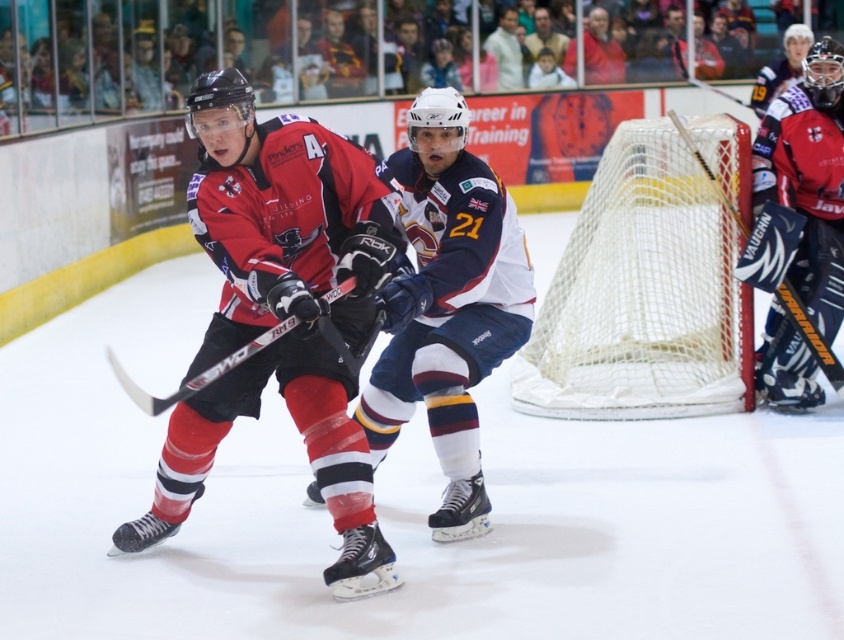
Find the location of a particular element. The height and width of the screenshot is (640, 844). matte black jersey at center is located at coordinates (280, 312).

Is point (301, 234) farther from viewer compared to point (837, 368)?

No, it is in front of (837, 368).

Where is `matte black jersey at center`? This screenshot has height=640, width=844. matte black jersey at center is located at coordinates pyautogui.click(x=280, y=312).

Identify the location of matte black jersey at center. (280, 312).

Looking at this image, is red matte goalie at right below black matte hockey stick at center?

No, red matte goalie at right is not below black matte hockey stick at center.

Is red matte goalie at right bigger than black matte hockey stick at center?

Yes.

The height and width of the screenshot is (640, 844). What are the coordinates of `red matte goalie at right` in the screenshot? It's located at (809, 179).

Where is `red matte goalie at right`? This screenshot has width=844, height=640. red matte goalie at right is located at coordinates (809, 179).

Who is higher up, matte black jersey at center or red matte goalie at right?

red matte goalie at right

Is point (198, 349) positioned behind point (798, 202)?

No, (198, 349) is closer to viewer.

Find the location of a particular element. matte black jersey at center is located at coordinates (280, 312).